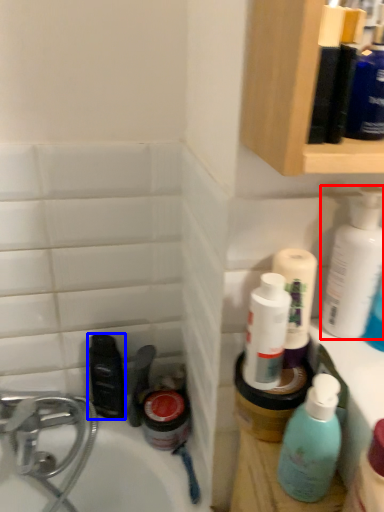
Question: Which object is closer to the camera taking this photo, cleaning product (highlighted by a red box) or mouthwash (highlighted by a blue box)?

Choices:
 (A) cleaning product
 (B) mouthwash

Answer: (A)